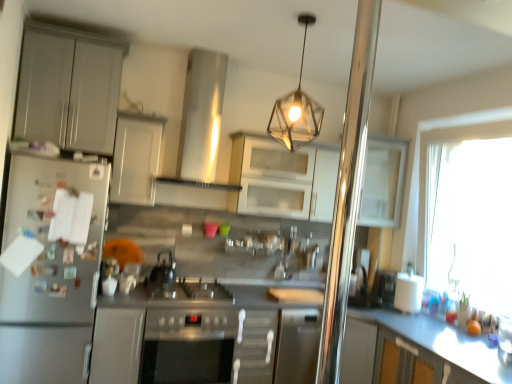
Find the location of `empty space that is ontop of satin silver exhaust hood at upper center (from a real-world perspective)`. empty space that is ontop of satin silver exhaust hood at upper center (from a real-world perspective) is located at coordinates (206, 51).